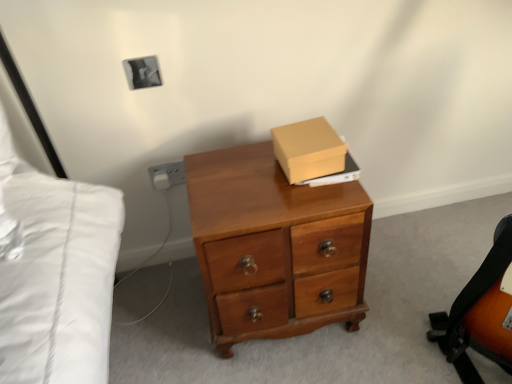
Question: Does matte gray electric outlet at lower left have a larger size compared to orange leather messenger bag at lower right?

Choices:
 (A) no
 (B) yes

Answer: (A)

Question: Would you consider matte gray electric outlet at lower left to be distant from orange leather messenger bag at lower right?

Choices:
 (A) yes
 (B) no

Answer: (A)

Question: Can you confirm if matte gray electric outlet at lower left is wider than orange leather messenger bag at lower right?

Choices:
 (A) yes
 (B) no

Answer: (B)

Question: From a real-world perspective, is matte gray electric outlet at lower left beneath orange leather messenger bag at lower right?

Choices:
 (A) no
 (B) yes

Answer: (A)

Question: Considering the relative positions of matte gray electric outlet at lower left and orange leather messenger bag at lower right in the image provided, is matte gray electric outlet at lower left to the right of orange leather messenger bag at lower right from the viewer's perspective?

Choices:
 (A) yes
 (B) no

Answer: (B)

Question: From their relative heights in the image, would you say matte gray electric outlet at lower left is taller or shorter than matte cardboard box at upper center?

Choices:
 (A) tall
 (B) short

Answer: (B)

Question: Is matte gray electric outlet at lower left spatially inside matte cardboard box at upper center, or outside of it?

Choices:
 (A) inside
 (B) outside

Answer: (B)

Question: Based on their positions, is matte gray electric outlet at lower left located to the left or right of matte cardboard box at upper center?

Choices:
 (A) left
 (B) right

Answer: (A)

Question: From the image's perspective, is matte gray electric outlet at lower left above or below matte cardboard box at upper center?

Choices:
 (A) below
 (B) above

Answer: (A)

Question: Considering the positions of matte gray electric outlet at lower left and wooden desk at center in the image, is matte gray electric outlet at lower left wider or thinner than wooden desk at center?

Choices:
 (A) thin
 (B) wide

Answer: (A)

Question: From the image's perspective, is matte gray electric outlet at lower left above or below wooden desk at center?

Choices:
 (A) above
 (B) below

Answer: (A)

Question: Is matte gray electric outlet at lower left to the left or to the right of wooden desk at center in the image?

Choices:
 (A) left
 (B) right

Answer: (A)

Question: Is matte gray electric outlet at lower left situated inside wooden desk at center or outside?

Choices:
 (A) inside
 (B) outside

Answer: (B)

Question: From their relative heights in the image, would you say wooden desk at center is taller or shorter than orange leather messenger bag at lower right?

Choices:
 (A) tall
 (B) short

Answer: (A)

Question: Is wooden desk at center in front of or behind orange leather messenger bag at lower right in the image?

Choices:
 (A) behind
 (B) front

Answer: (B)